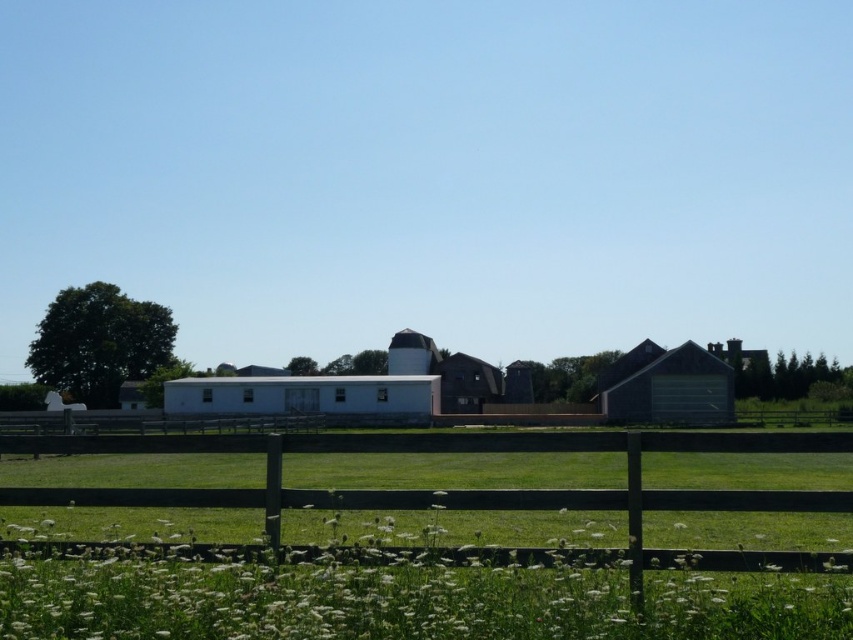
Question: Among these objects, which one is farthest from the camera?

Choices:
 (A) green corrugated metal barn at right
 (B) white matte barn at center

Answer: (A)

Question: Which of the following is the closest to the observer?

Choices:
 (A) green corrugated metal barn at right
 (B) white matte barn at center

Answer: (B)

Question: Is white matte barn at center smaller than green corrugated metal barn at right?

Choices:
 (A) yes
 (B) no

Answer: (B)

Question: Does white matte barn at center have a larger size compared to green corrugated metal barn at right?

Choices:
 (A) no
 (B) yes

Answer: (B)

Question: Among these objects, which one is farthest from the camera?

Choices:
 (A) white matte barn at center
 (B) green corrugated metal barn at right

Answer: (B)

Question: Is white matte barn at center to the right of green corrugated metal barn at right from the viewer's perspective?

Choices:
 (A) no
 (B) yes

Answer: (A)